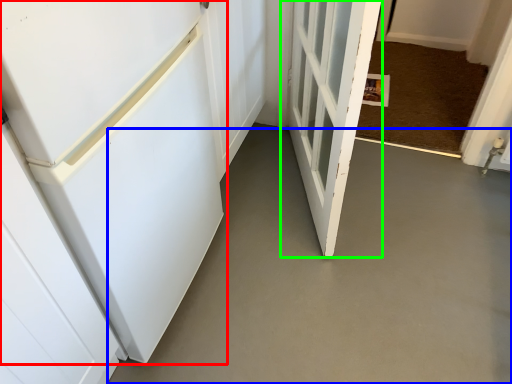
Question: Based on their relative distances, which object is nearer to door (highlighted by a red box)? Choose from concrete (highlighted by a blue box) and door (highlighted by a green box).

Choices:
 (A) concrete
 (B) door

Answer: (B)